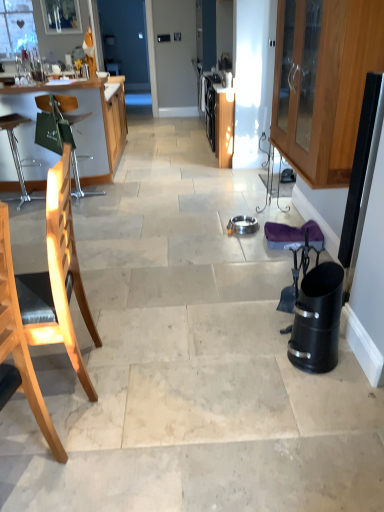
Question: Is wooden chair at left, which is counted as the first chair, starting from the back, at the left side of black plastic trash can at right?

Choices:
 (A) yes
 (B) no

Answer: (A)

Question: Is wooden chair at left, positioned as the third chair in front-to-back order, further to the viewer compared to black plastic trash can at right?

Choices:
 (A) no
 (B) yes

Answer: (B)

Question: Is wooden chair at left, positioned as the third chair in front-to-back order, smaller than black plastic trash can at right?

Choices:
 (A) yes
 (B) no

Answer: (B)

Question: Can you confirm if wooden chair at left, which is counted as the first chair, starting from the back, is taller than black plastic trash can at right?

Choices:
 (A) no
 (B) yes

Answer: (B)

Question: From a real-world perspective, is wooden chair at left, positioned as the third chair in front-to-back order, located beneath black plastic trash can at right?

Choices:
 (A) no
 (B) yes

Answer: (A)

Question: From the image's perspective, relative to light wood chair at left, the 1th chair when ordered from front to back, is wooden cabinet at right above or below?

Choices:
 (A) above
 (B) below

Answer: (A)

Question: Is point (347, 137) closer or farther from the camera than point (48, 421)?

Choices:
 (A) closer
 (B) farther

Answer: (B)

Question: Is wooden cabinet at right in front of or behind light wood chair at left, which is the third chair from back to front, in the image?

Choices:
 (A) front
 (B) behind

Answer: (B)

Question: Is wooden cabinet at right inside the boundaries of light wood chair at left, the 1th chair when ordered from front to back, or outside?

Choices:
 (A) inside
 (B) outside

Answer: (B)

Question: Would you say light wood chair at left, the 1th chair when ordered from front to back, is to the left or to the right of wooden cabinet at right in the picture?

Choices:
 (A) right
 (B) left

Answer: (B)

Question: Which is correct: light wood chair at left, which is the third chair from back to front, is inside wooden cabinet at right, or outside of it?

Choices:
 (A) inside
 (B) outside

Answer: (B)

Question: Is point (41, 397) positioned closer to the camera than point (345, 123)?

Choices:
 (A) farther
 (B) closer

Answer: (B)

Question: From their relative heights in the image, would you say light wood chair at left, which is the third chair from back to front, is taller or shorter than wooden cabinet at right?

Choices:
 (A) tall
 (B) short

Answer: (A)

Question: Is light wood chair at left, positioned as the 2th chair in back-to-front order, in front of or behind light wood chair at left, the 1th chair when ordered from front to back, in the image?

Choices:
 (A) behind
 (B) front

Answer: (A)

Question: Is light wood chair at left, positioned as the 2th chair in back-to-front order, taller or shorter than light wood chair at left, which is the third chair from back to front?

Choices:
 (A) short
 (B) tall

Answer: (A)